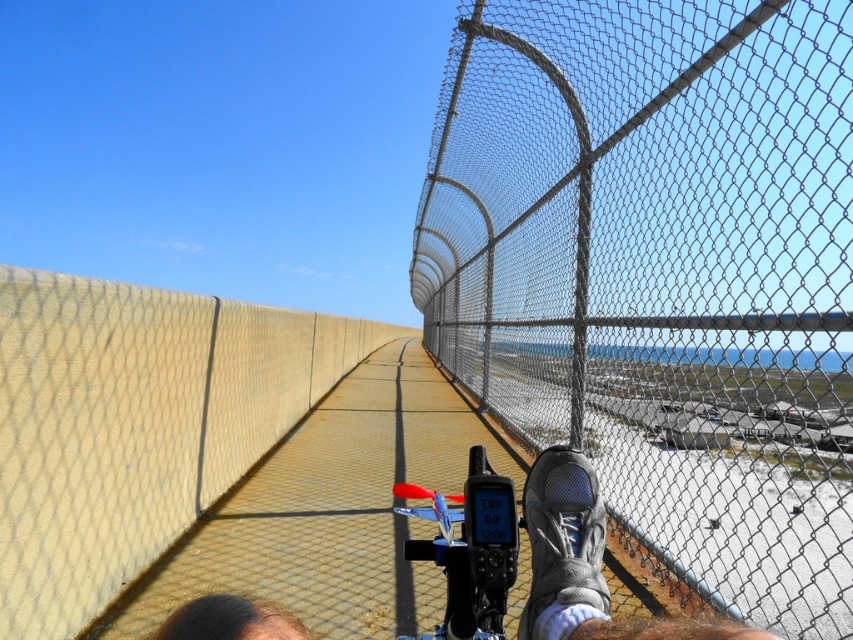
Based on the photo, which is more to the right, metal mesh fence at right or yellow concrete wall at center?

metal mesh fence at right

Is metal mesh fence at right positioned behind yellow concrete wall at center?

Yes, metal mesh fence at right is further from the viewer.

Identify the location of metal mesh fence at right. (662, 273).

Who is higher up, metal mesh fence at right or gray fabric shoe at lower center?

Positioned higher is gray fabric shoe at lower center.

At what (x,y) coordinates should I click in order to perform the action: click on metal mesh fence at right. Please return your answer as a coordinate pair (x, y). Looking at the image, I should click on (662, 273).

Who is more forward, [541,552] or [590,500]?

Positioned in front is point [541,552].

Which is below, gray fabric shoe at lower center or gray mesh shoe at center?

Answer: gray mesh shoe at center is lower down.

Is point (233, 595) in front of point (582, 524)?

That is True.

Where is `gray fabric shoe at lower center`? gray fabric shoe at lower center is located at coordinates (566, 554).